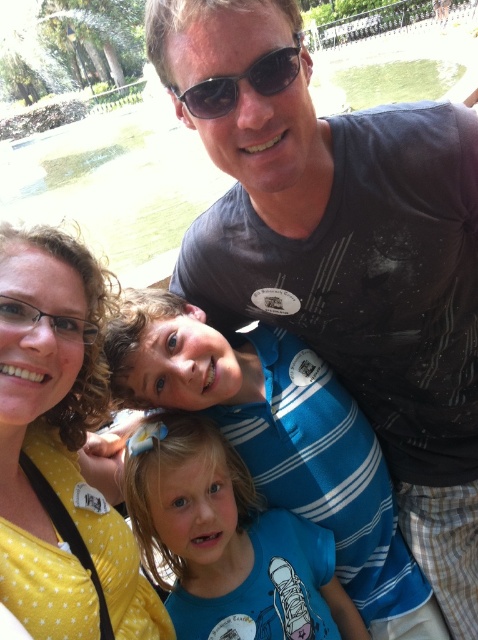
Question: Is dark gray t-shirt at upper center smaller than blue striped shirt at center?

Choices:
 (A) no
 (B) yes

Answer: (B)

Question: Among these points, which one is farthest from the camera?

Choices:
 (A) (322, 472)
 (B) (93, 337)
 (C) (202, 234)

Answer: (C)

Question: Can you confirm if blue striped shirt at center is wider than yellow dotted shirt at lower left?

Choices:
 (A) no
 (B) yes

Answer: (B)

Question: Is dark gray t-shirt at upper center thinner than blue striped shirt at center?

Choices:
 (A) no
 (B) yes

Answer: (B)

Question: Which point is farther to the camera?

Choices:
 (A) (467, 269)
 (B) (248, 406)
 (C) (262, 88)
 (D) (66, 515)

Answer: (B)

Question: Which object is farther from the camera taking this photo?

Choices:
 (A) dark gray t-shirt at upper center
 (B) yellow dotted shirt at lower left
 (C) black reflective sunglasses at upper center
 (D) blue striped shirt at center

Answer: (A)